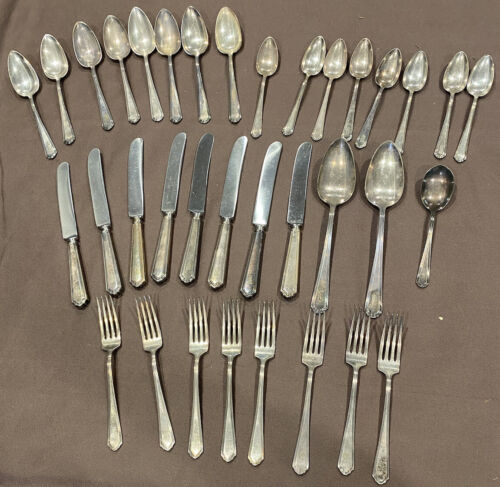
Image resolution: width=500 pixels, height=487 pixels. I want to click on forks, so click(x=107, y=342), click(x=151, y=341), click(x=202, y=348), click(x=230, y=346), click(x=262, y=350), click(x=309, y=356), click(x=355, y=359), click(x=388, y=363).